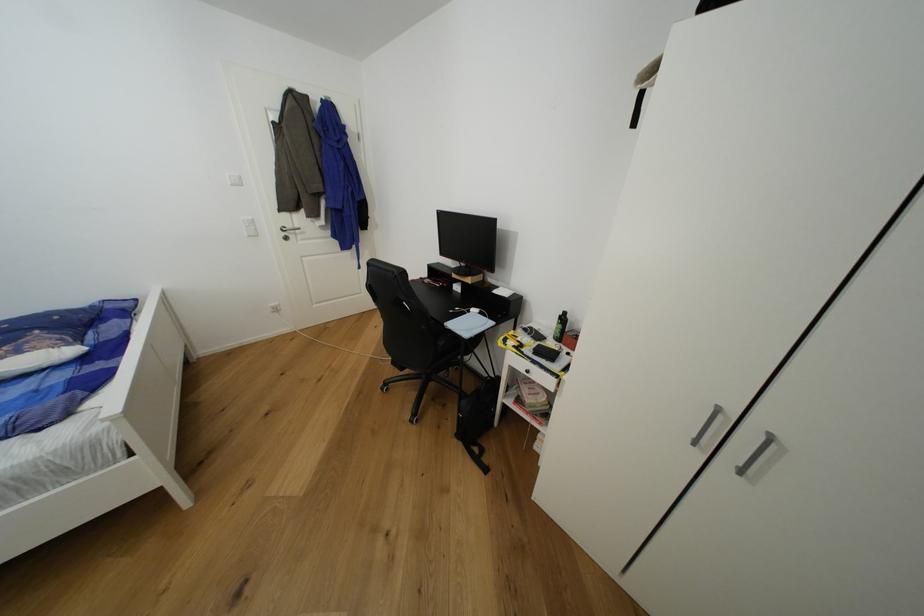
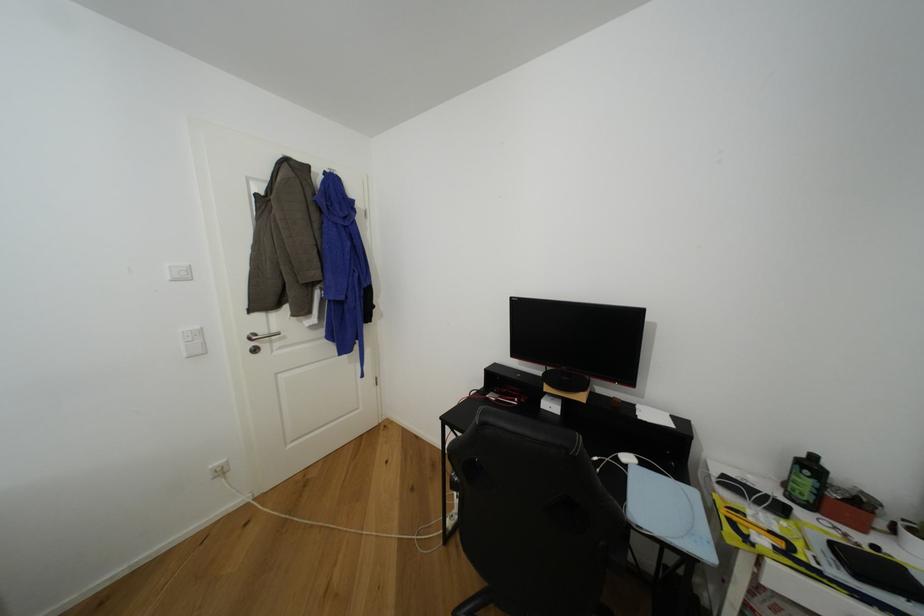
Locate, in the second image, the point that corresponds to the point at 480,312 in the first image.

(633, 460)